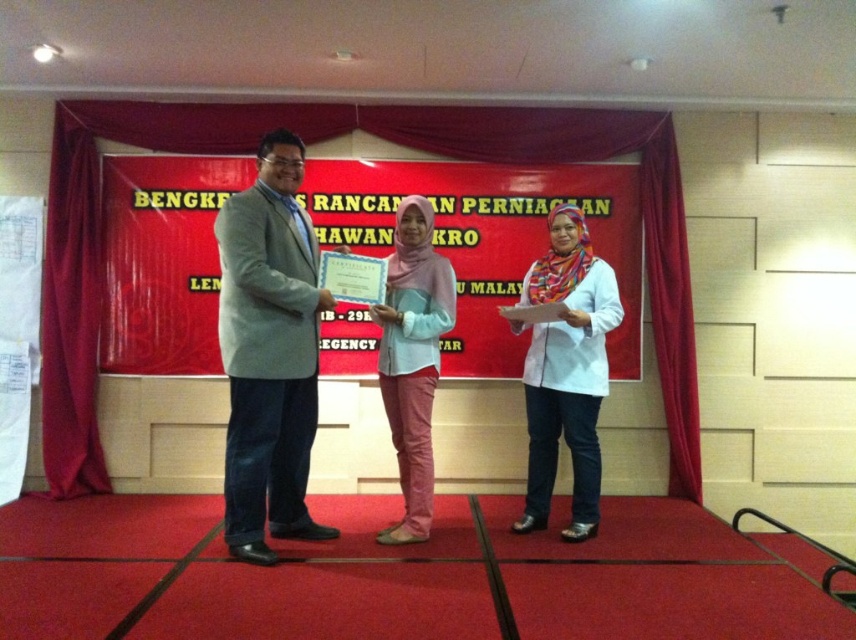
Can you confirm if white paper at center is shorter than light gray suit at center?

Indeed, white paper at center has a lesser height compared to light gray suit at center.

Does white paper at center have a larger size compared to light gray suit at center?

No.

Is point (119, 241) less distant than point (306, 336)?

No, (119, 241) is further to viewer.

At what (x,y) coordinates should I click in order to perform the action: click on white paper at center. Please return your answer as a coordinate pair (x, y). The image size is (856, 640). Looking at the image, I should click on (486, 240).

Which of these two, white paper at center or red velvet curtain at center, stands shorter?

With less height is white paper at center.

Between white paper at center and red velvet curtain at center, which one is positioned higher?

red velvet curtain at center

Identify the location of white paper at center. (486, 240).

Locate an element on the screen. white paper at center is located at coordinates (486, 240).

Does point (663, 284) come farther from viewer compared to point (223, 324)?

Yes, it is behind point (223, 324).

Which is behind, point (417, 109) or point (296, 161)?

Point (417, 109)

Is point (685, 305) positioned after point (260, 257)?

Yes, it is behind point (260, 257).

Find the location of a particular element. This screenshot has width=856, height=640. red velvet curtain at center is located at coordinates (325, 140).